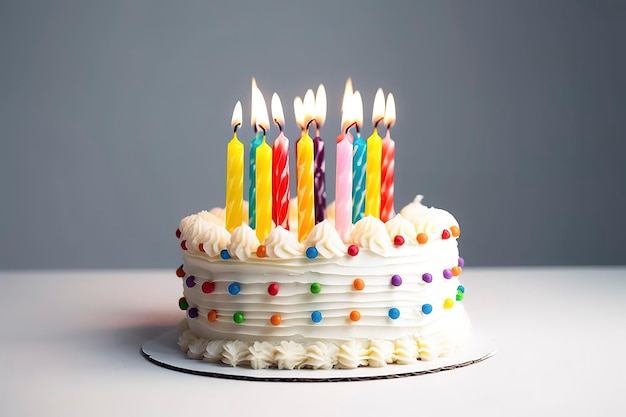
Locate an element on the screen. The image size is (626, 417). yellow birthday candles is located at coordinates (230, 188), (264, 181), (305, 179), (372, 167).